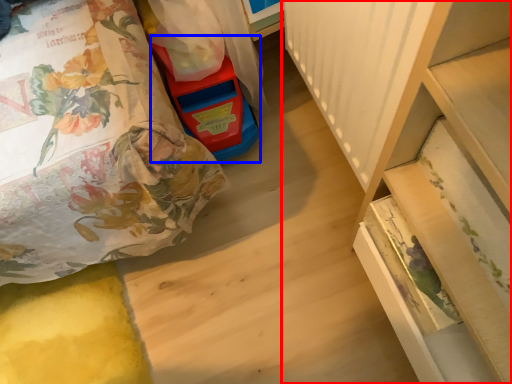
Question: Which point is closer to the camera, furniture (highlighted by a red box) or toy (highlighted by a blue box)?

Choices:
 (A) furniture
 (B) toy

Answer: (A)